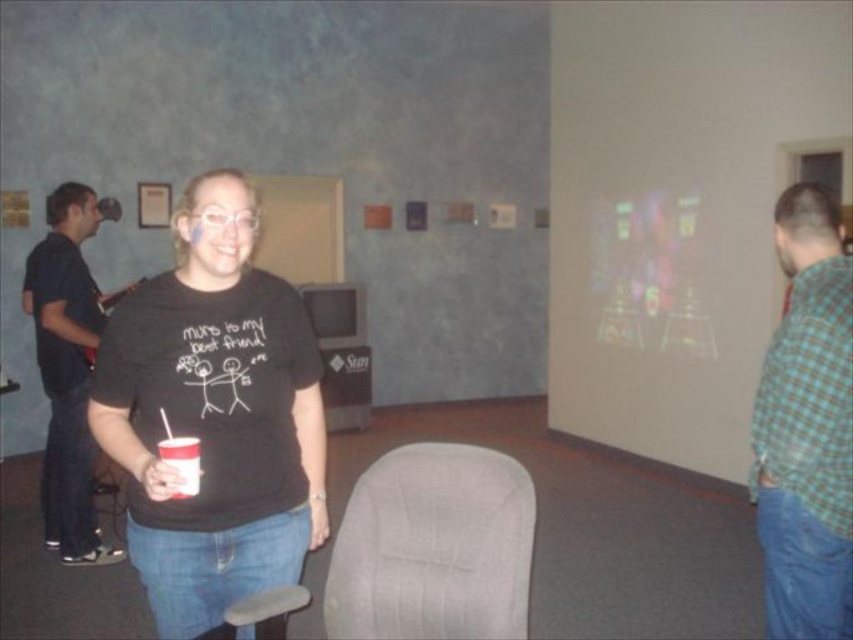
Does dark blue shirt at left have a greater width compared to white plastic cup at center?

Yes, dark blue shirt at left is wider than white plastic cup at center.

Who is taller, dark blue shirt at left or white plastic cup at center?

dark blue shirt at left

Locate an element on the screen. The height and width of the screenshot is (640, 853). dark blue shirt at left is located at coordinates (67, 371).

Can you confirm if checkered fabric shirt at right is smaller than gray fabric swivel chair at center?

Incorrect, checkered fabric shirt at right is not smaller in size than gray fabric swivel chair at center.

Between point (840, 262) and point (498, 525), which one is positioned behind?

The point (840, 262) is behind.

I want to click on checkered fabric shirt at right, so click(x=805, y=428).

Can you confirm if gray fabric swivel chair at center is positioned above dark blue shirt at left?

No, gray fabric swivel chair at center is not above dark blue shirt at left.

Image resolution: width=853 pixels, height=640 pixels. Describe the element at coordinates (433, 547) in the screenshot. I see `gray fabric swivel chair at center` at that location.

Between point (349, 634) and point (39, 280), which one is positioned behind?

Positioned behind is point (39, 280).

Where is `gray fabric swivel chair at center`? Image resolution: width=853 pixels, height=640 pixels. gray fabric swivel chair at center is located at coordinates (433, 547).